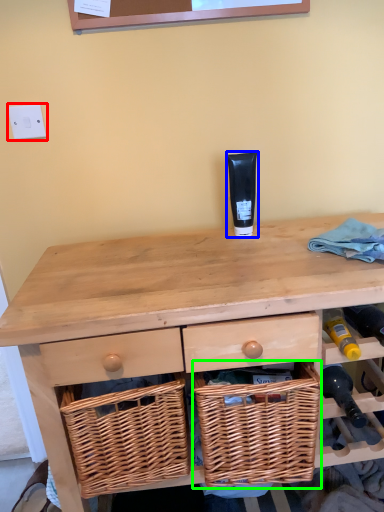
Question: Estimate the real-world distances between objects in this image. Which object is farther from electric outlet (highlighted by a red box), toiletry (highlighted by a blue box) or picnic basket (highlighted by a green box)?

Choices:
 (A) toiletry
 (B) picnic basket

Answer: (B)